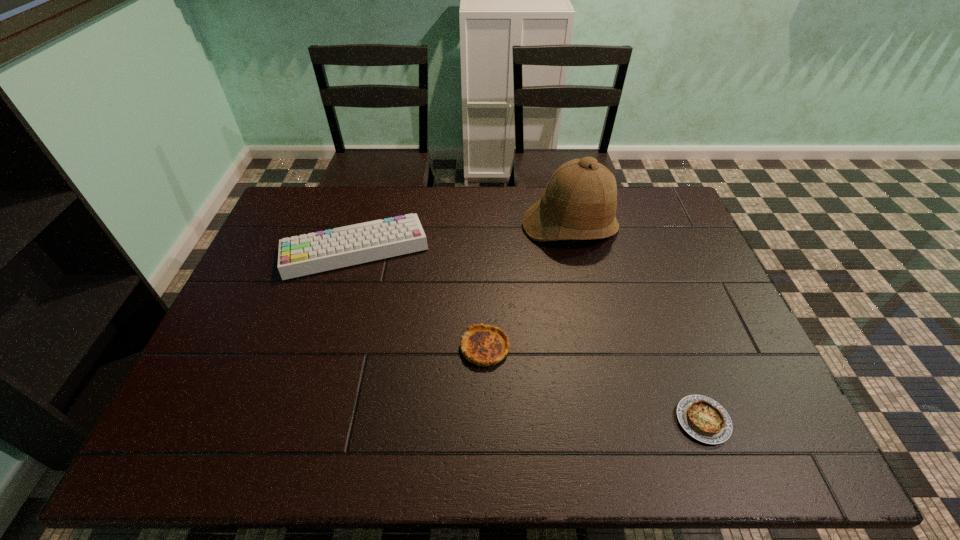
At what (x,y) coordinates should I click in order to perform the action: click on free space located 0.120m on the right of the right quiche. Please return your answer as a coordinate pair (x, y). This screenshot has width=960, height=540. Looking at the image, I should click on (780, 421).

You are a GUI agent. You are given a task and a screenshot of the screen. Output one action in this format:
    pyautogui.click(x=<x>, y=<y>)
    Task: Click on the hat at the far edge
    
    Given the screenshot: What is the action you would take?
    pyautogui.click(x=579, y=202)

Find the location of a particular element. computer keyboard located at the far edge is located at coordinates [302, 255].

This screenshot has width=960, height=540. I want to click on object that is positioned at the near edge, so click(x=704, y=419).

Identify the location of object at the left edge. This screenshot has width=960, height=540. (302, 255).

Image resolution: width=960 pixels, height=540 pixels. Identify the location of object that is at the right edge. (704, 419).

Locate an element on the screen. The height and width of the screenshot is (540, 960). object present at the far left corner is located at coordinates (302, 255).

Locate an element on the screen. This screenshot has height=540, width=960. object located at the near right corner is located at coordinates (704, 419).

Where is `vacant space at the far edge of the desktop`? vacant space at the far edge of the desktop is located at coordinates (380, 201).

Where is `vacant space at the near edge`? The width and height of the screenshot is (960, 540). vacant space at the near edge is located at coordinates (530, 429).